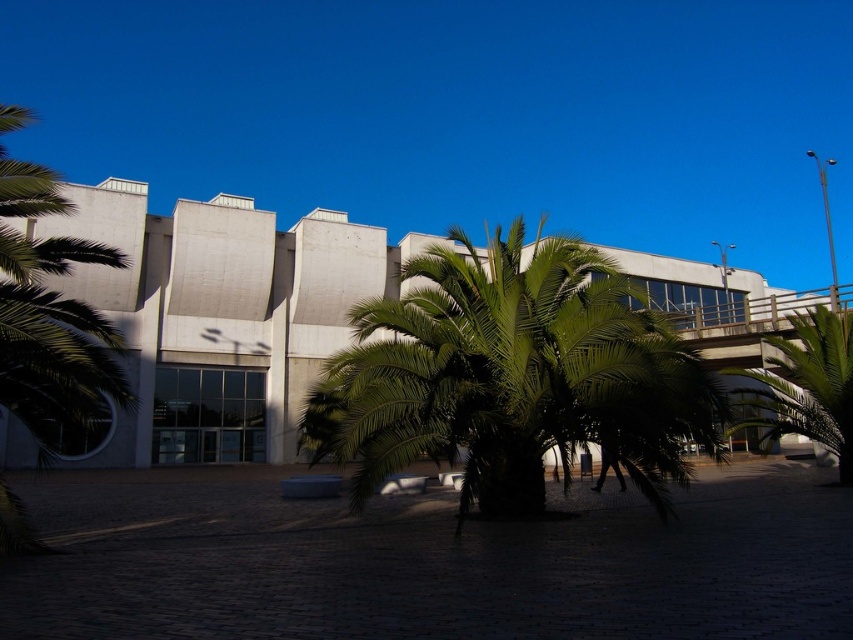
Is point (509, 310) positioned after point (825, 378)?

No, it is not.

Consider the image. Which is more to the right, green leafy palm tree at center or green leafy palm tree at right?

green leafy palm tree at right

In order to click on green leafy palm tree at center in this screenshot , I will do `click(511, 376)`.

Where is `green leafy palm tree at center`? The width and height of the screenshot is (853, 640). green leafy palm tree at center is located at coordinates (511, 376).